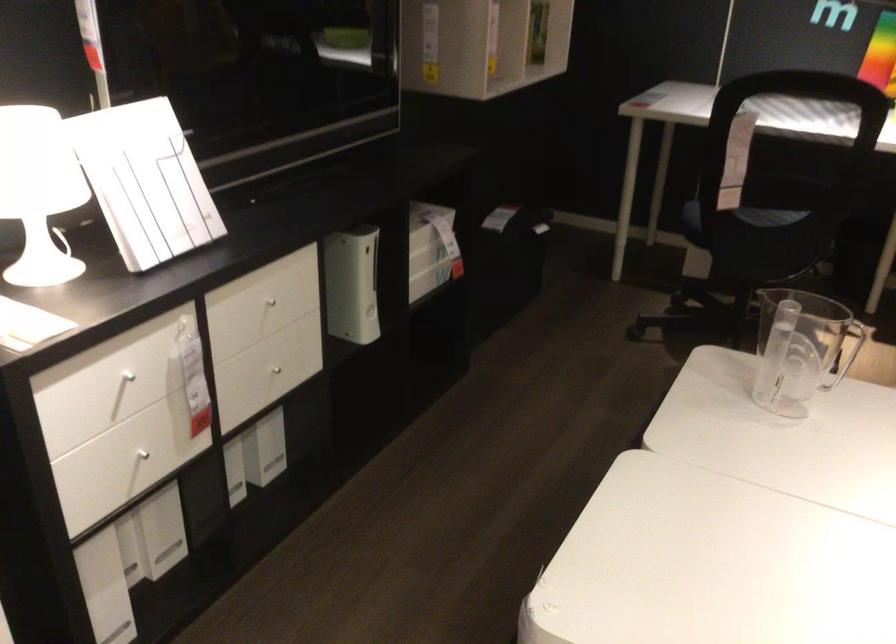
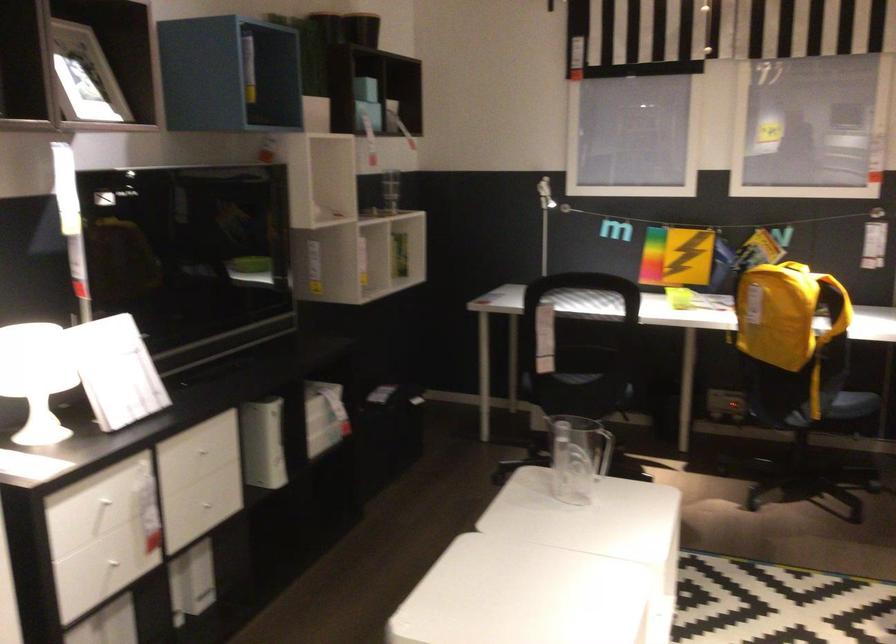
Find the pixel in the second image that matches (274,366) in the first image.

(209, 504)